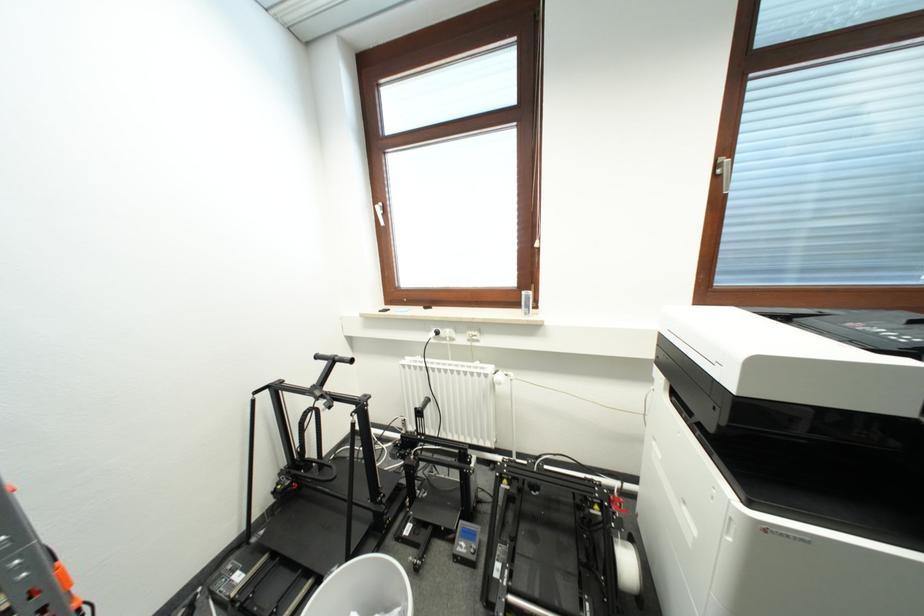
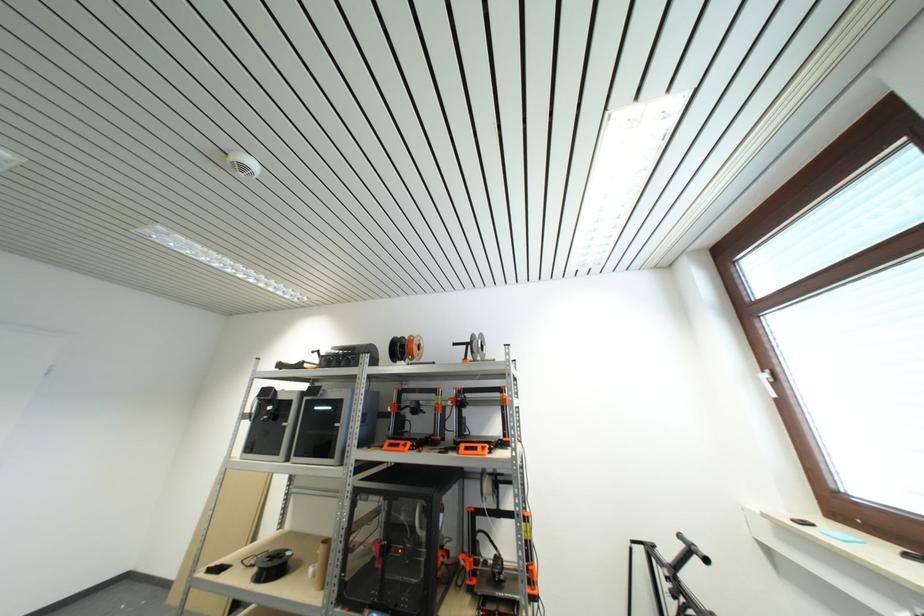
The images are taken continuously from a first-person perspective. In which direction is your viewpoint rotating?

The camera's rotation is toward left-up.